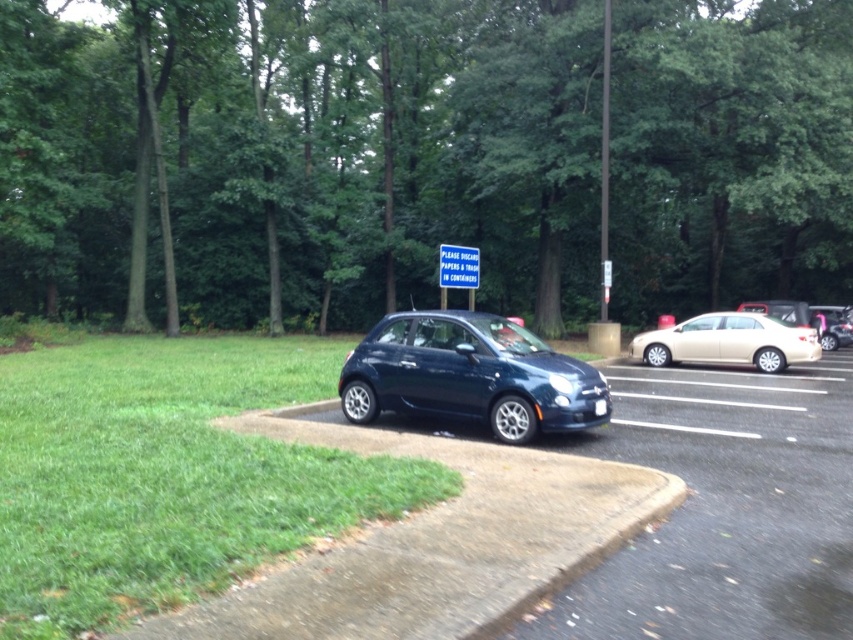
Between point (662, 353) and point (463, 250), which one is positioned in front?

Point (463, 250)

Does satin gold sedan at right appear on the left side of blue plastic sign at center?

No, satin gold sedan at right is not to the left of blue plastic sign at center.

I want to click on satin gold sedan at right, so click(728, 340).

Where is `satin gold sedan at right`? satin gold sedan at right is located at coordinates (728, 340).

Who is positioned more to the left, glossy dark blue hatchback at center or satin gold sedan at right?

glossy dark blue hatchback at center is more to the left.

Between glossy dark blue hatchback at center and satin gold sedan at right, which one has more height?

Standing taller between the two is satin gold sedan at right.

Between point (572, 369) and point (701, 336), which one is positioned behind?

Point (701, 336)

The image size is (853, 640). I want to click on glossy dark blue hatchback at center, so click(x=469, y=376).

Who is more forward, (598, 422) or (450, 259)?

Point (598, 422) is more forward.

Does glossy dark blue hatchback at center appear over blue plastic sign at center?

No, glossy dark blue hatchback at center is not above blue plastic sign at center.

Between point (496, 349) and point (467, 285), which one is positioned behind?

Point (467, 285)

Where is `glossy dark blue hatchback at center`? The width and height of the screenshot is (853, 640). glossy dark blue hatchback at center is located at coordinates (469, 376).